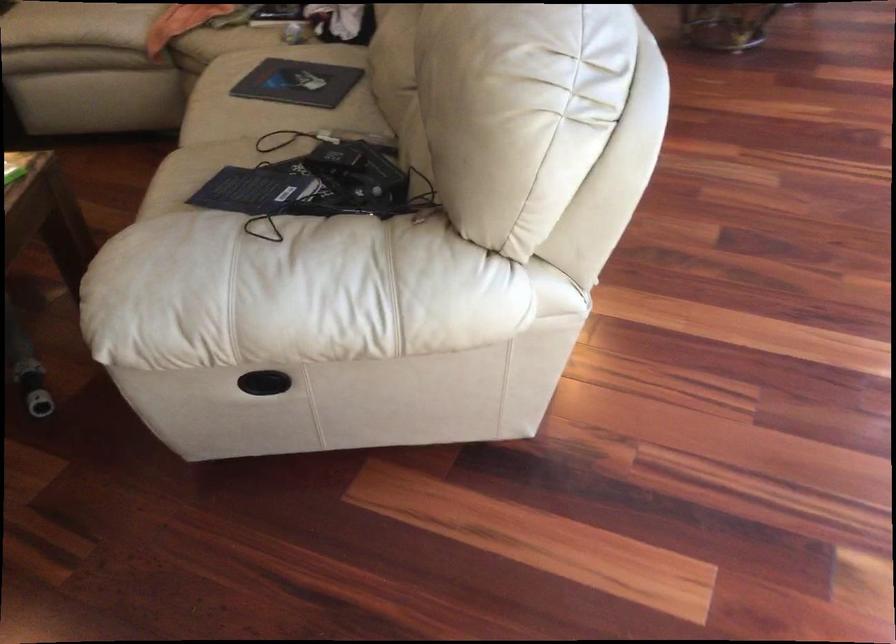
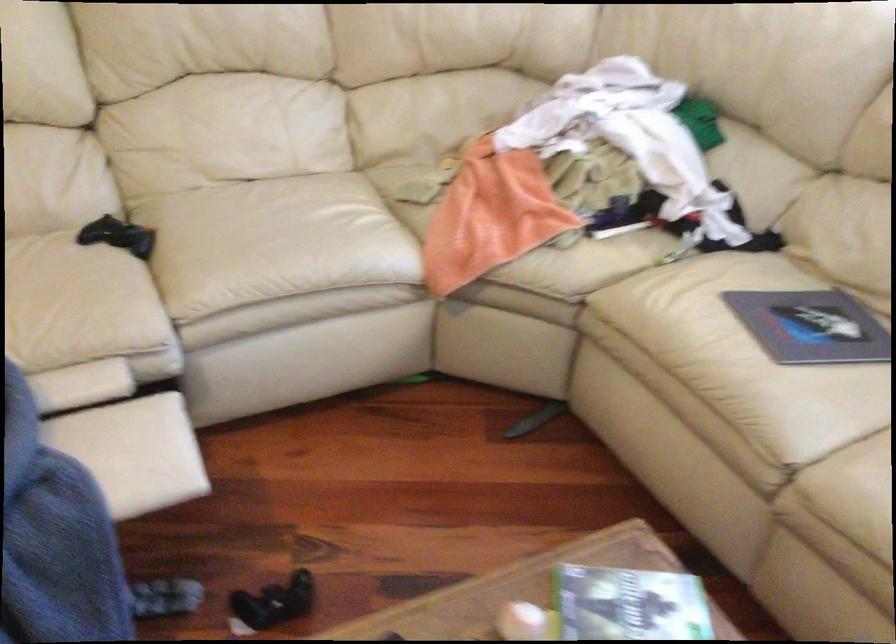
From the picture: Which direction would the cameraman need to move to produce the second image?

The movement direction of the cameraman is left, forward.